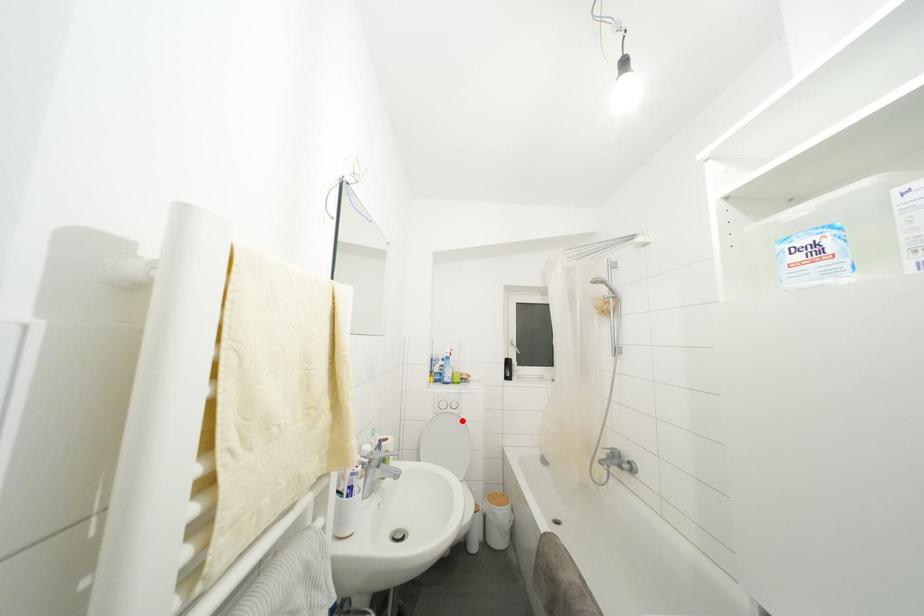
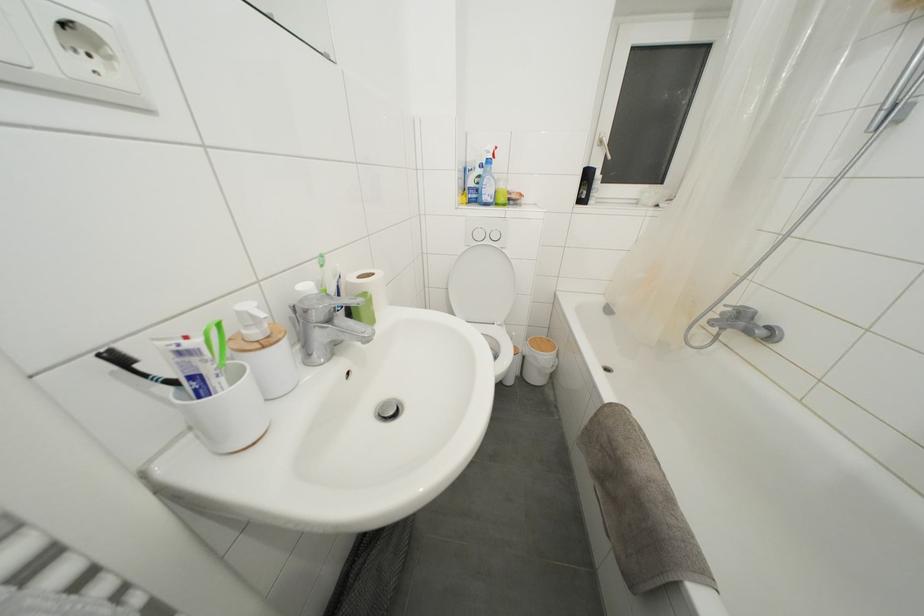
Where in the second image is the point corresponding to the highlighted location from the first image?

(505, 256)